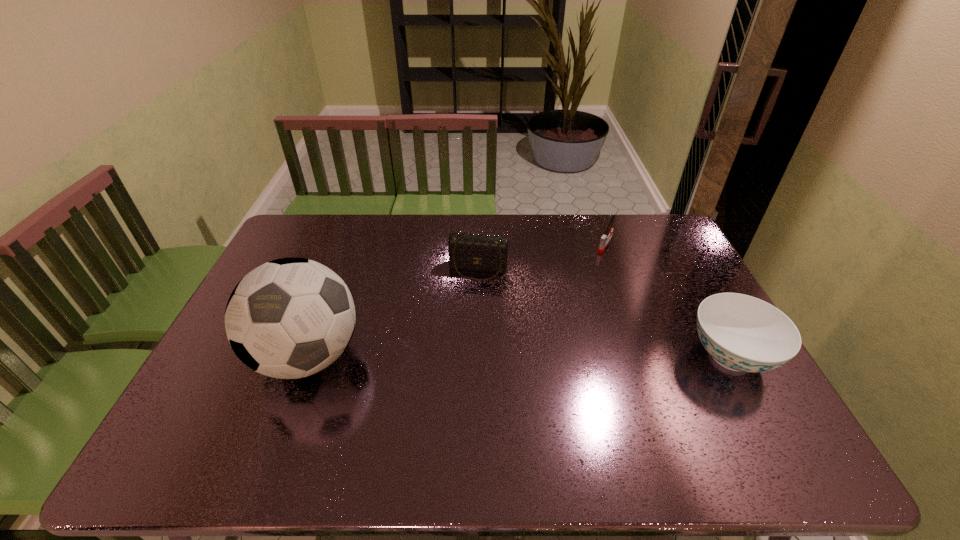
Identify the location of free space on the desktop that is between the tallest object and the rightmost object and is positioned on the handle side of the stapler. The width and height of the screenshot is (960, 540). (528, 356).

Locate an element on the screen. This screenshot has width=960, height=540. free spot on the desktop that is between the tallest object and the chinaware and is positioned on the front flap of the second farthest object is located at coordinates (459, 356).